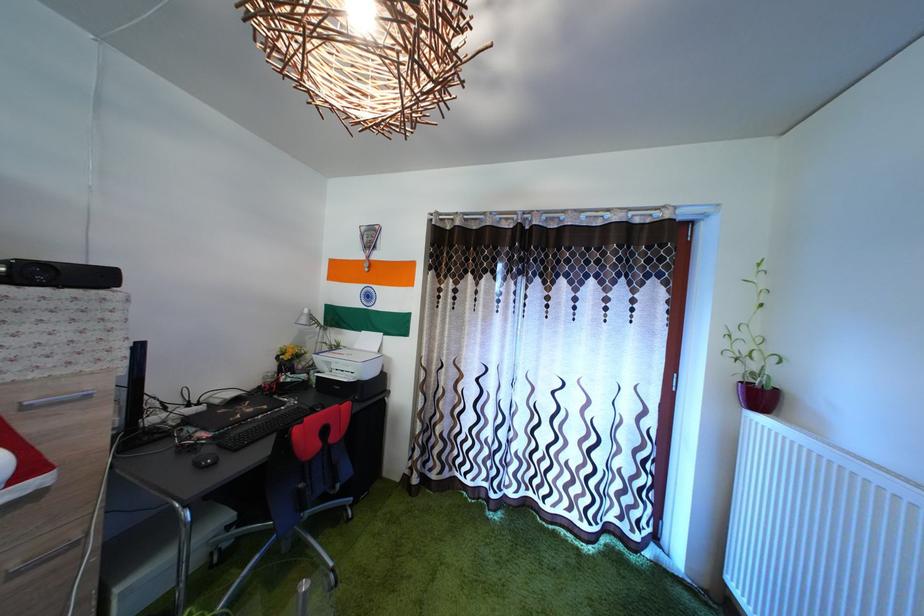
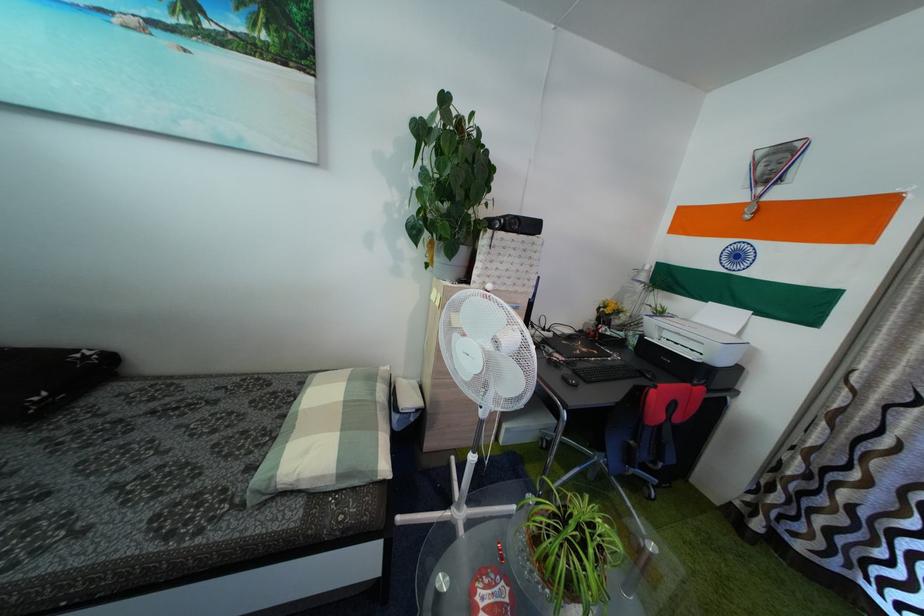
In the second image, find the point that corresponds to point 262,432 in the first image.

(599, 371)